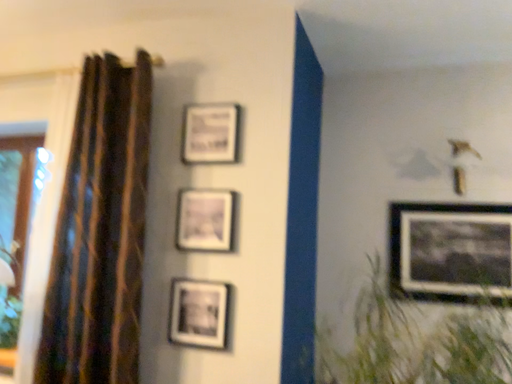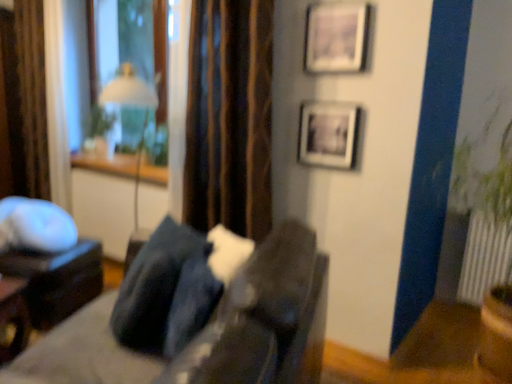
Question: Which way did the camera rotate in the video?

Choices:
 (A) rotated right
 (B) rotated left

Answer: (B)